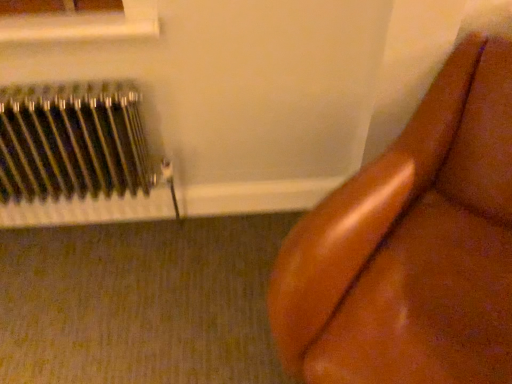
Question: Are metallic silver radiator at left and brown leather couch at right beside each other?

Choices:
 (A) no
 (B) yes

Answer: (A)

Question: Does metallic silver radiator at left have a lesser height compared to brown leather couch at right?

Choices:
 (A) no
 (B) yes

Answer: (B)

Question: Can you confirm if metallic silver radiator at left is bigger than brown leather couch at right?

Choices:
 (A) yes
 (B) no

Answer: (B)

Question: Is brown leather couch at right inside metallic silver radiator at left?

Choices:
 (A) yes
 (B) no

Answer: (B)

Question: Is metallic silver radiator at left to the right of brown leather couch at right from the viewer's perspective?

Choices:
 (A) yes
 (B) no

Answer: (B)

Question: From a real-world perspective, is metallic silver radiator at left physically above brown leather couch at right?

Choices:
 (A) yes
 (B) no

Answer: (A)

Question: Is brown leather couch at right a part of white plastic window frame at upper left?

Choices:
 (A) no
 (B) yes

Answer: (A)

Question: Is white plastic window frame at upper left oriented towards brown leather couch at right?

Choices:
 (A) yes
 (B) no

Answer: (B)

Question: Does white plastic window frame at upper left come in front of brown leather couch at right?

Choices:
 (A) no
 (B) yes

Answer: (A)

Question: Can you confirm if white plastic window frame at upper left is taller than brown leather couch at right?

Choices:
 (A) no
 (B) yes

Answer: (A)

Question: Does white plastic window frame at upper left have a larger size compared to brown leather couch at right?

Choices:
 (A) no
 (B) yes

Answer: (A)

Question: From the image's perspective, is white plastic window frame at upper left above brown leather couch at right?

Choices:
 (A) yes
 (B) no

Answer: (A)

Question: Does white plastic window frame at upper left have a lesser height compared to metallic silver radiator at left?

Choices:
 (A) yes
 (B) no

Answer: (A)